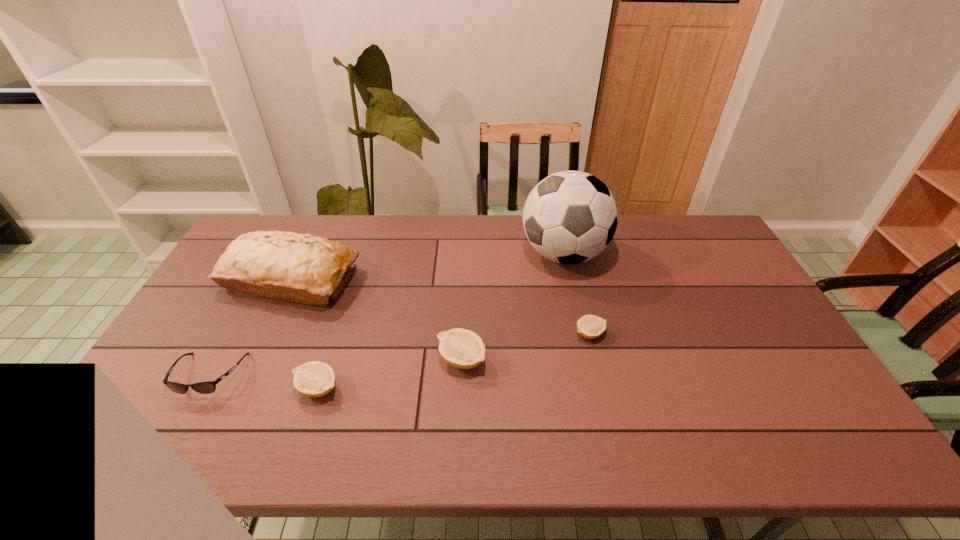
The height and width of the screenshot is (540, 960). I want to click on sunglasses present at the left edge, so click(x=208, y=387).

Image resolution: width=960 pixels, height=540 pixels. I want to click on object positioned at the far left corner, so click(288, 266).

At what (x,y) coordinates should I click in order to perform the action: click on object that is at the near left corner. Please return your answer as a coordinate pair (x, y). This screenshot has width=960, height=540. Looking at the image, I should click on (208, 387).

I want to click on vacant region at the far edge of the desktop, so click(x=388, y=220).

You are a GUI agent. You are given a task and a screenshot of the screen. Output one action in this format:
    pyautogui.click(x=<x>, y=<y>)
    Task: Click on the vacant region at the left edge of the desktop
    
    Given the screenshot: What is the action you would take?
    pyautogui.click(x=244, y=319)

In the image, there is a desktop. Where is `vacant space at the right edge`? This screenshot has height=540, width=960. vacant space at the right edge is located at coordinates (701, 258).

What are the coordinates of `free space at the near right corner` in the screenshot? It's located at (770, 394).

Locate an element on the screen. free space between the shortest lemon and the soccer ball is located at coordinates (577, 294).

Identify the location of free point between the fifth shortest object and the second tallest lemon. (304, 334).

Find the location of `free space that is in between the leftmost lemon and the fifth shortest object`. free space that is in between the leftmost lemon and the fifth shortest object is located at coordinates (304, 334).